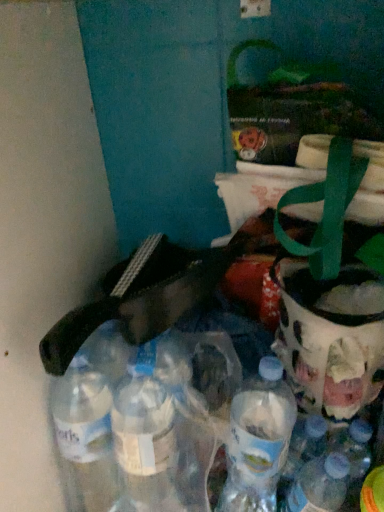
Question: Considering the positions of translucent plastic bottle at lower right, which ranks as the 2th bottle in left-to-right order, and translucent glass jar at right in the image, is translucent plastic bottle at lower right, which ranks as the 2th bottle in left-to-right order, taller or shorter than translucent glass jar at right?

Choices:
 (A) tall
 (B) short

Answer: (A)

Question: From a real-world perspective, relative to translucent glass jar at right, is translucent plastic bottle at lower right, which ranks as the 2th bottle in left-to-right order, vertically above or below?

Choices:
 (A) above
 (B) below

Answer: (B)

Question: Based on their relative distances, which object is nearer to the translucent glass jar at right?

Choices:
 (A) clear plastic bottles at lower left, the 2th bottle positioned from the right
 (B) translucent plastic bottle at lower right, the first bottle when ordered from right to left

Answer: (B)

Question: Based on their relative distances, which object is farther from the translucent plastic bottle at lower right, which ranks as the 2th bottle in left-to-right order?

Choices:
 (A) translucent glass jar at right
 (B) clear plastic bottles at lower left, the first bottle from the left

Answer: (B)